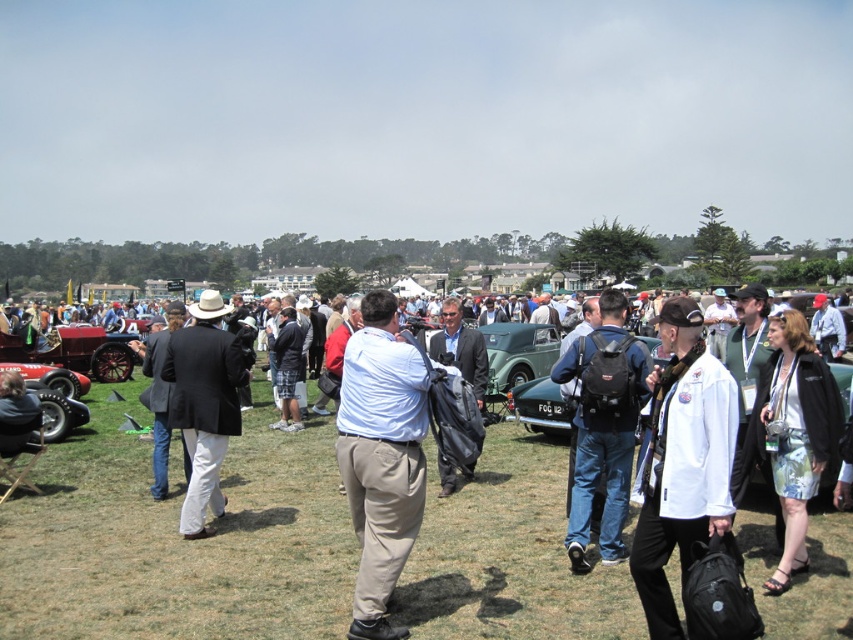
You are standing at the edge of the car show field and want to approach the green matte car at center to admire it up close. There is a man in a light blue shirt at center blocking your path. Can you walk around him to reach the car without getting too close?

The light blue shirt at center and green matte car at center are 5.97 meters apart, so yes, you can walk around the man in the light blue shirt at center to reach the green matte car at center since there is enough space between them.

You are standing at the origin point of the image coordinate system. Where is the floral skirt at center located in terms of its 2D coordinates?

The floral skirt at center is located at the 2D coordinates of point (x=798, y=433).

You are at the car show and want to find the matte black bag at center. Where should you look relative to the light blue shirt at center?

The light blue shirt at center is in front of the matte black bag at center, so you should look behind the light blue shirt at center to find the matte black bag at center.